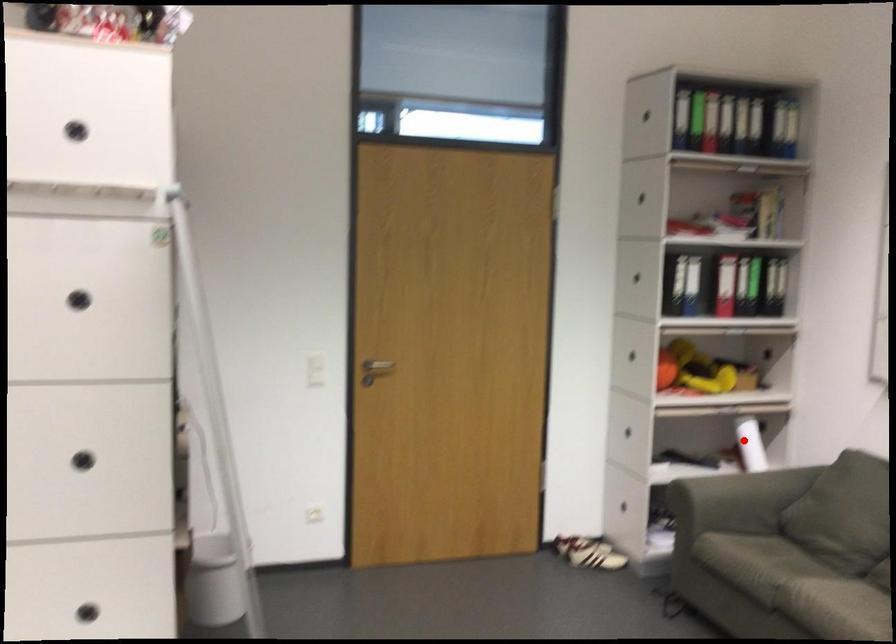
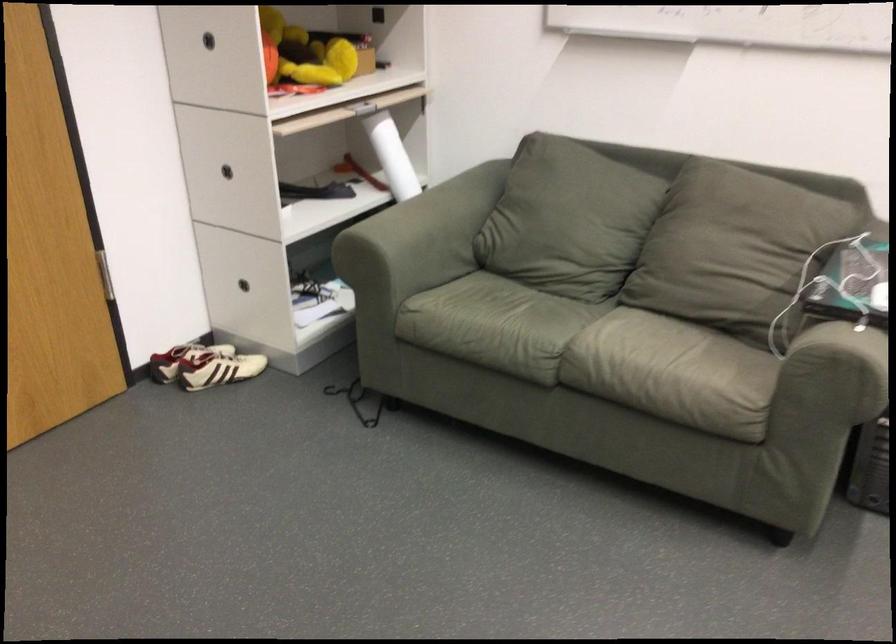
In the second image, find the point that corresponds to the highlighted location in the first image.

(392, 156)